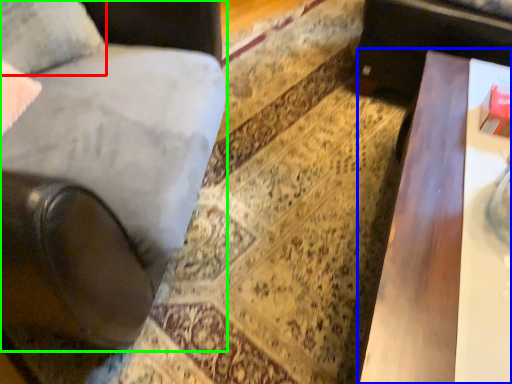
Question: Considering the real-world distances, which object is closest to pillow (highlighted by a red box)? table (highlighted by a blue box) or chair (highlighted by a green box).

Choices:
 (A) table
 (B) chair

Answer: (B)